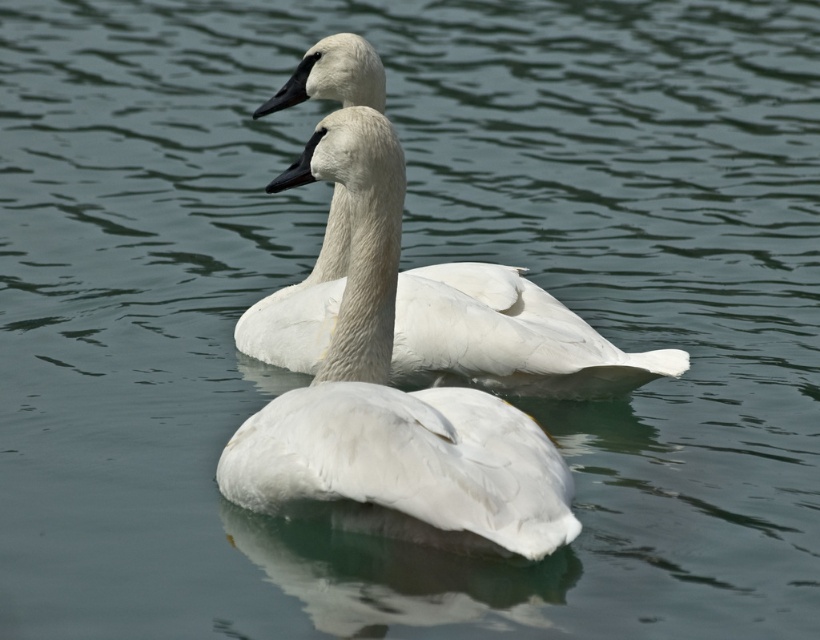
Consider the image. You are an ornithologist observing two swans in the water. You notice both the white feathered swan at center and the white matte swan at center. Which swan do you think is bigger?

The white feathered swan at center is larger in size compared to the white matte swan at center.

You are a photographer trying to capture the swans in the image. You notice two white swans at the center. Which swan, the white feathered swan at center or the white matte swan at center, appears closer to you?

The white feathered swan at center appears closer because it is positioned in front of the white matte swan at center.